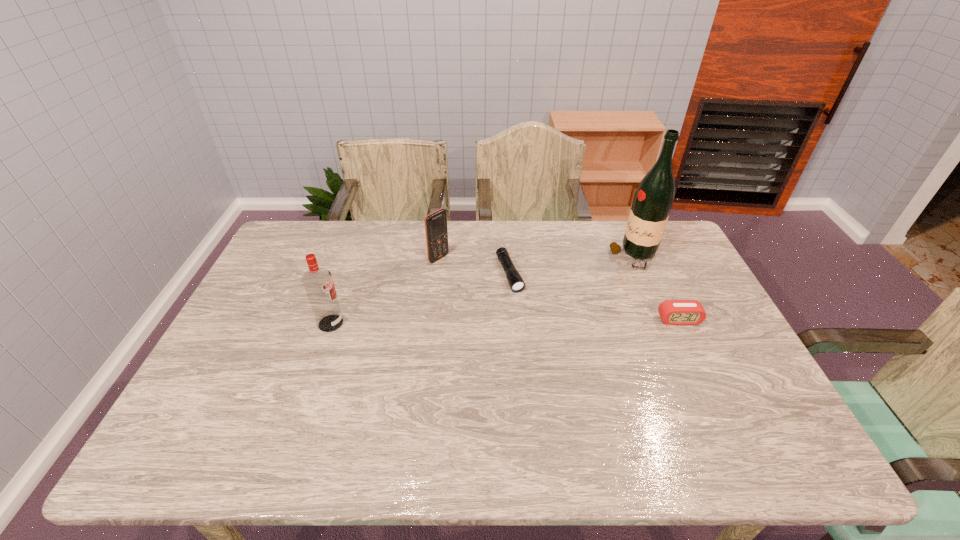
Identify the location of free space on the desktop that is between the fourth shortest object and the alarm clock and is positioned on the surface of the tallest object. (517, 321).

Identify the location of free space on the desktop that is between the leftmost object and the alarm clock and is positioned on the screen of the fourth object from right to left. (536, 321).

Identify the location of free space on the desktop that is between the leftmost object and the alarm clock and is positioned at the lens end of the shortest object. (533, 321).